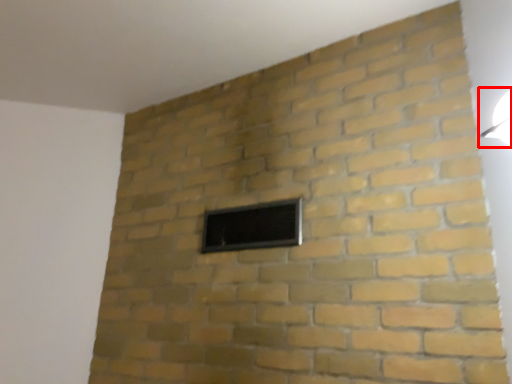
Question: From the image's perspective, where is light fixture (annotated by the red box) located in relation to window in the image?

Choices:
 (A) below
 (B) above

Answer: (B)